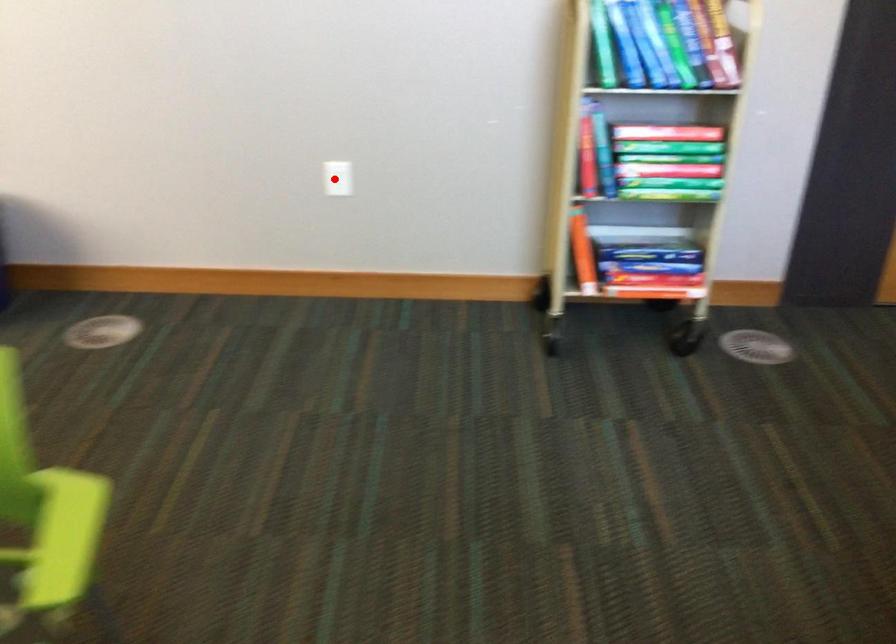
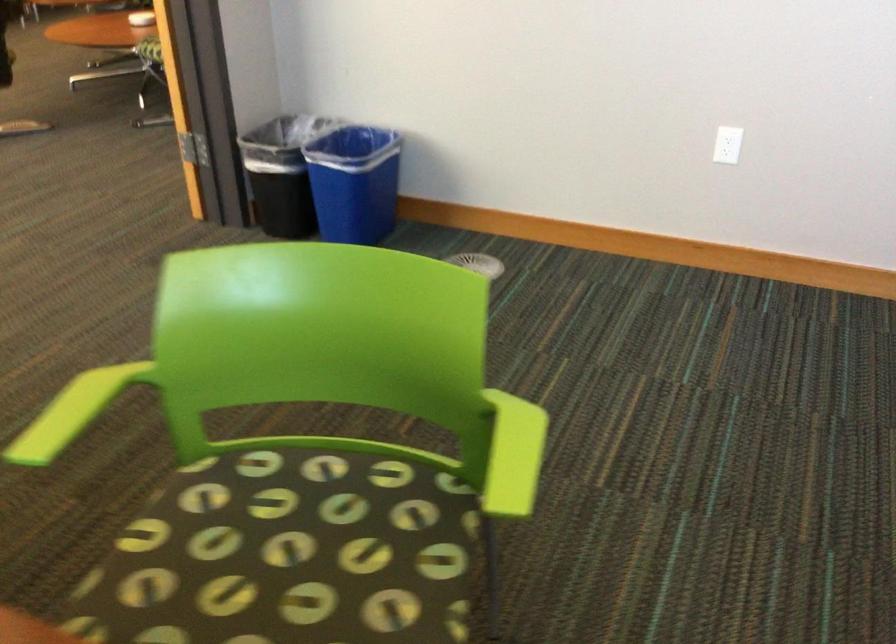
Find the pixel in the second image that matches the highlighted location in the first image.

(728, 144)